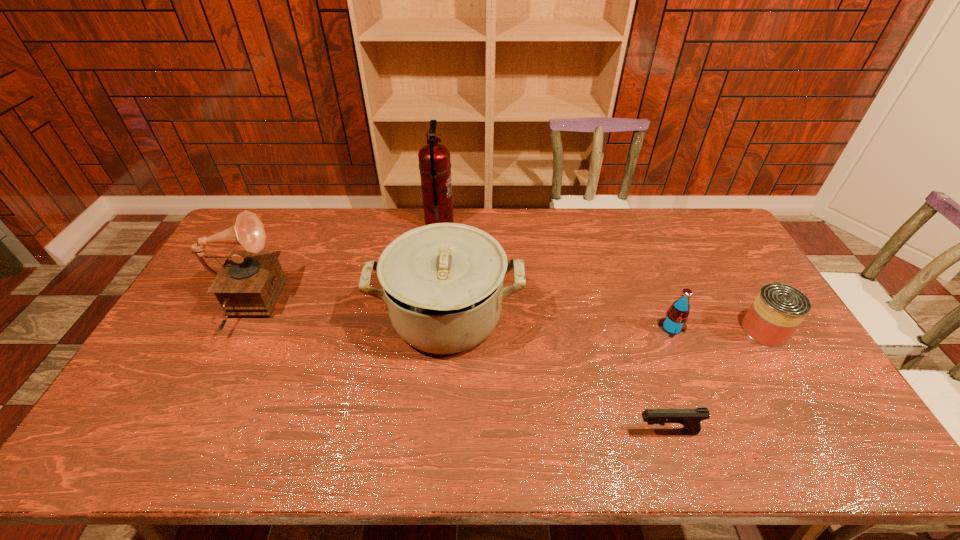
Locate an element on the screen. object present at the right edge is located at coordinates [x=778, y=309].

Where is `vacant space at the far edge of the desktop`? vacant space at the far edge of the desktop is located at coordinates (310, 234).

Locate an element on the screen. The image size is (960, 540). blank space at the near edge of the desktop is located at coordinates (354, 445).

The height and width of the screenshot is (540, 960). I want to click on vacant space at the left edge, so click(x=171, y=382).

In the image, there is a desktop. Where is `blank space at the right edge`? The width and height of the screenshot is (960, 540). blank space at the right edge is located at coordinates (804, 424).

This screenshot has height=540, width=960. Find the location of `free space between the leftmost object and the fire extinguisher`. free space between the leftmost object and the fire extinguisher is located at coordinates (343, 266).

Find the location of a particular element. free space between the shortest object and the leftmost object is located at coordinates (456, 369).

Where is `free space between the rightmost object and the saucepan`? free space between the rightmost object and the saucepan is located at coordinates (606, 323).

Where is `blank region between the saucepan and the soda`? The height and width of the screenshot is (540, 960). blank region between the saucepan and the soda is located at coordinates (559, 322).

Where is `empty location between the third tallest object and the can`? The image size is (960, 540). empty location between the third tallest object and the can is located at coordinates (606, 323).